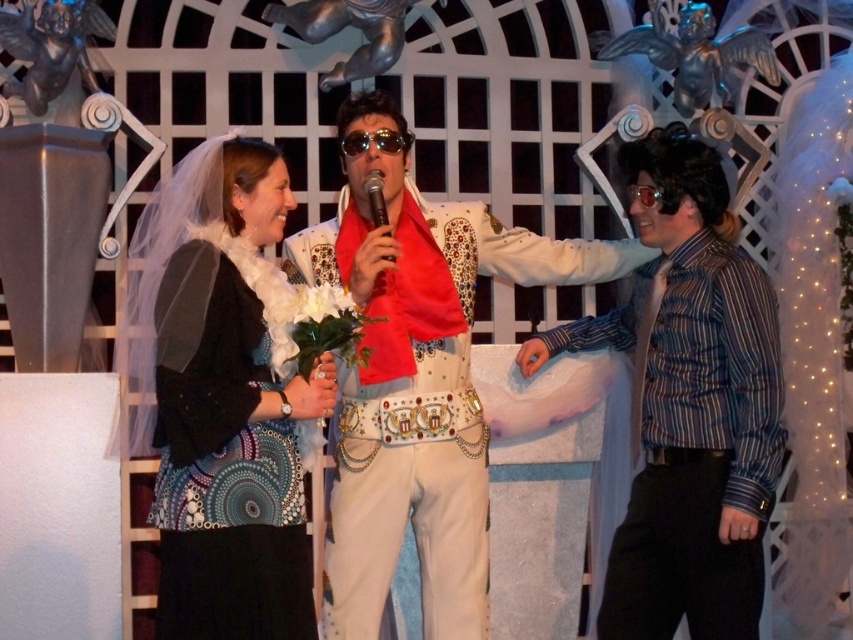
Does black textured dress at center have a lesser height compared to sunglasses at center?

No, black textured dress at center is not shorter than sunglasses at center.

Is black textured dress at center thinner than sunglasses at center?

No, black textured dress at center is not thinner than sunglasses at center.

Identify the location of black textured dress at center. (225, 404).

Identify the location of black textured dress at center. The width and height of the screenshot is (853, 640). (225, 404).

Is striped shirt at right taller than sunglasses at center?

Indeed, striped shirt at right has a greater height compared to sunglasses at center.

How far apart are striped shirt at right and sunglasses at center?

A distance of 10.49 feet exists between striped shirt at right and sunglasses at center.

Does point (712, 192) lie in front of point (390, 140)?

Yes, point (712, 192) is closer to viewer.

At what (x,y) coordinates should I click in order to perform the action: click on striped shirt at right. Please return your answer as a coordinate pair (x, y). The width and height of the screenshot is (853, 640). Looking at the image, I should click on (688, 403).

Which of these two, matte black dress at center or metallic silver microphone at center, stands taller?

With more height is matte black dress at center.

Does matte black dress at center have a lesser height compared to metallic silver microphone at center?

Incorrect, matte black dress at center's height does not fall short of metallic silver microphone at center's.

Is point (397, 348) positioned after point (373, 188)?

No, it is in front of (373, 188).

The height and width of the screenshot is (640, 853). Identify the location of matte black dress at center. (419, 369).